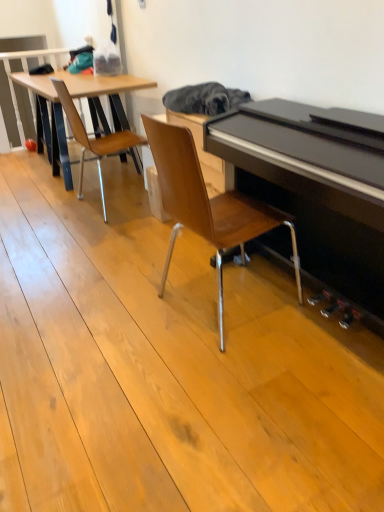
Question: Considering the relative sizes of wooden chair at center, which appears as the 2th chair when viewed from the back, and wooden chair at left, which is the 1th chair from back to front, in the image provided, is wooden chair at center, which appears as the 2th chair when viewed from the back, shorter than wooden chair at left, which is the 1th chair from back to front,?

Choices:
 (A) no
 (B) yes

Answer: (A)

Question: Is wooden chair at center, which is the first chair from front to back, turned away from wooden chair at left, arranged as the second chair when viewed from the right?

Choices:
 (A) yes
 (B) no

Answer: (B)

Question: Is wooden chair at center, which is the first chair from front to back, far away from wooden chair at left, arranged as the second chair when viewed from the right?

Choices:
 (A) yes
 (B) no

Answer: (A)

Question: Is wooden chair at center, arranged as the 1th chair when viewed from the right, in front of wooden chair at left, which is the 1th chair from back to front?

Choices:
 (A) yes
 (B) no

Answer: (A)

Question: Does wooden chair at center, which appears as the second chair when viewed from the left, have a greater width compared to wooden chair at left, arranged as the second chair when viewed from the right?

Choices:
 (A) yes
 (B) no

Answer: (A)

Question: Does wooden chair at center, which appears as the 2th chair when viewed from the back, appear on the right side of wooden chair at left, arranged as the second chair when viewed from the right?

Choices:
 (A) no
 (B) yes

Answer: (B)

Question: From a real-world perspective, is wooden chair at left, which is the 1th chair from back to front, positioned over wooden chair at center, arranged as the 1th chair when viewed from the right, based on gravity?

Choices:
 (A) yes
 (B) no

Answer: (B)

Question: Is wooden chair at left, which is the 1th chair from back to front, beside wooden chair at center, which is the first chair from front to back?

Choices:
 (A) yes
 (B) no

Answer: (B)

Question: Is wooden chair at left, arranged as the second chair when viewed from the right, outside of wooden chair at center, which appears as the 2th chair when viewed from the back?

Choices:
 (A) no
 (B) yes

Answer: (B)

Question: Can you confirm if wooden chair at left, which is the first chair from left to right, is smaller than wooden chair at center, which appears as the second chair when viewed from the left?

Choices:
 (A) no
 (B) yes

Answer: (B)

Question: Is wooden chair at left, the second chair positioned from the front, facing towards wooden chair at center, arranged as the 1th chair when viewed from the right?

Choices:
 (A) yes
 (B) no

Answer: (B)

Question: Is wooden chair at left, arranged as the second chair when viewed from the right, bigger than wooden chair at center, which appears as the second chair when viewed from the left?

Choices:
 (A) yes
 (B) no

Answer: (B)

Question: In terms of height, does wooden chair at center, arranged as the 1th chair when viewed from the right, look taller or shorter compared to wooden chair at left, which is the first chair from left to right?

Choices:
 (A) short
 (B) tall

Answer: (B)